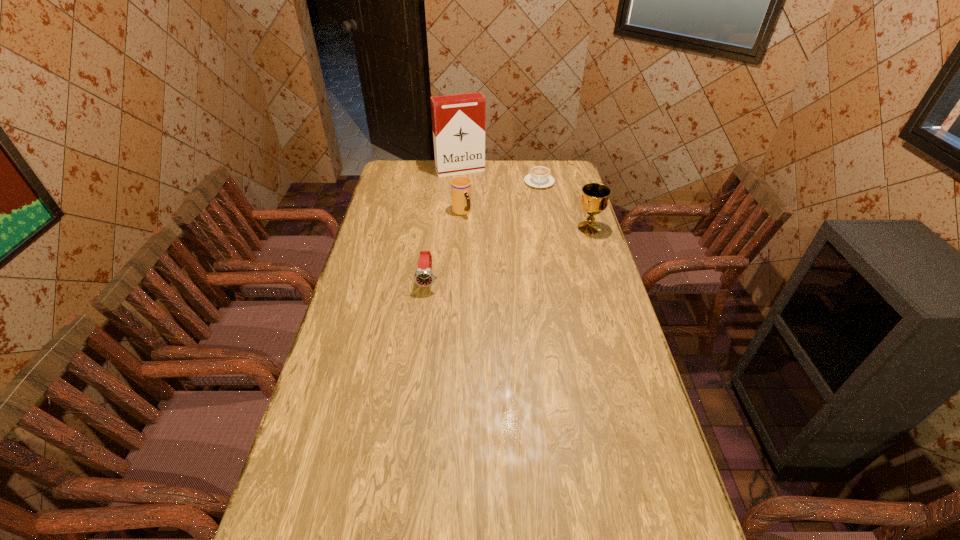
I want to click on empty location between the cup and the second shortest object, so click(444, 246).

Find the location of a particular element. empty location between the chalice and the third farthest object is located at coordinates (525, 220).

Locate an element on the screen. unoccupied position between the shortest object and the tallest object is located at coordinates (500, 177).

The width and height of the screenshot is (960, 540). Identify the location of blank region between the second object from right to left and the second shortest object. (484, 232).

This screenshot has width=960, height=540. I want to click on unoccupied area between the second shortest object and the cigarette_case, so click(x=444, y=226).

Where is `free spot between the chalice and the second object from right to left`? The width and height of the screenshot is (960, 540). free spot between the chalice and the second object from right to left is located at coordinates (564, 205).

Locate an element on the screen. Image resolution: width=960 pixels, height=540 pixels. vacant space that's between the tallest object and the cappuccino is located at coordinates (500, 177).

Select which object is the closest to the second nearest object. Please provide its 2D coordinates. Your answer should be formatted as a tuple, i.e. [(x, y)], where the tuple contains the x and y coordinates of a point satisfying the conditions above.

[(540, 177)]

Where is `object that is the closest to the cigarette_case`? This screenshot has width=960, height=540. object that is the closest to the cigarette_case is located at coordinates (540, 177).

I want to click on free spot that satisfies the following two spatial constraints: 1. on the front side of the cigarette_case; 2. on the right side of the rightmost object, so click(456, 228).